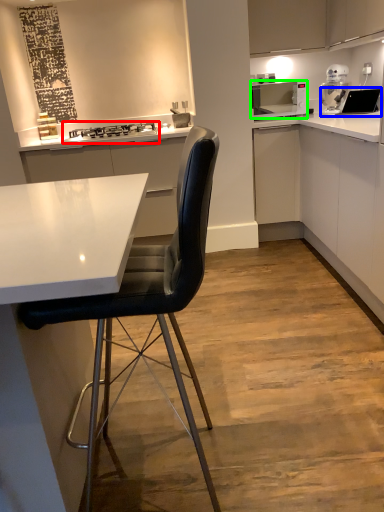
Question: Which object is the farthest from stove (highlighted by a red box)? Choose among these: sink (highlighted by a blue box) or home appliance (highlighted by a green box).

Choices:
 (A) sink
 (B) home appliance

Answer: (A)